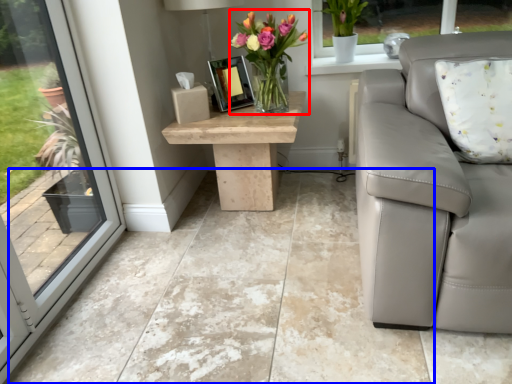
Question: Which object appears closest to the camera in this image, floral arrangement (highlighted by a red box) or concrete (highlighted by a blue box)?

Choices:
 (A) floral arrangement
 (B) concrete

Answer: (B)